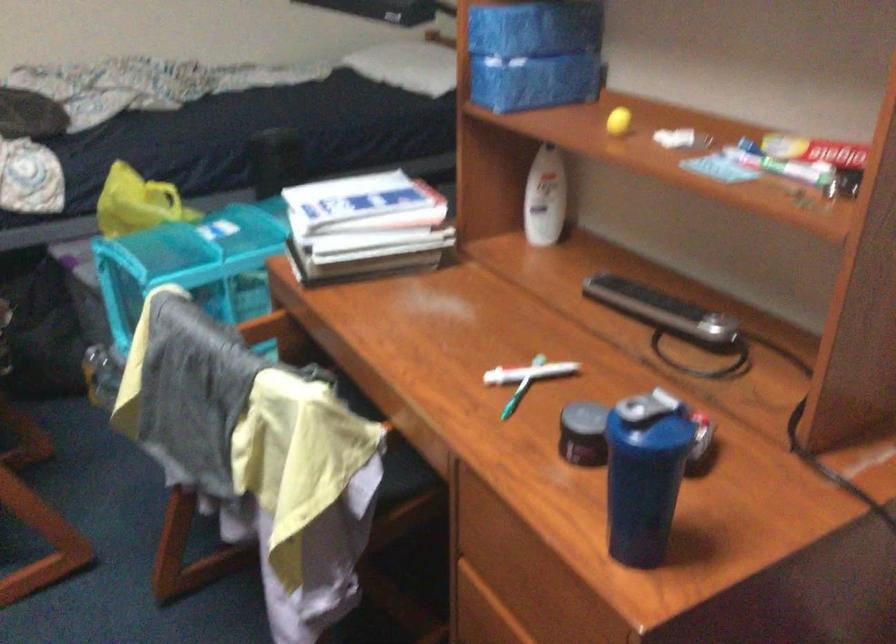
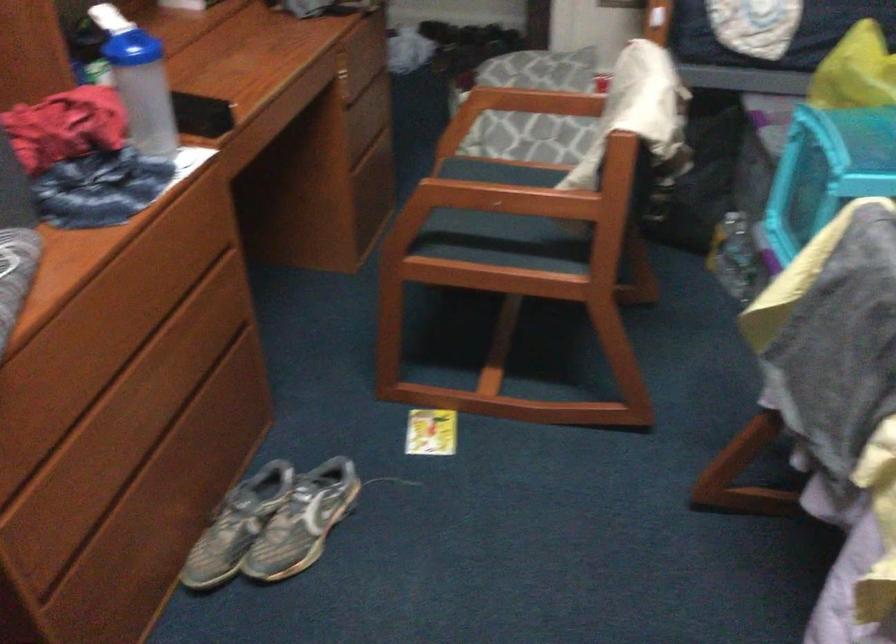
First-person continuous shooting, in which direction is the camera rotating?

The camera's rotation is toward left-down.